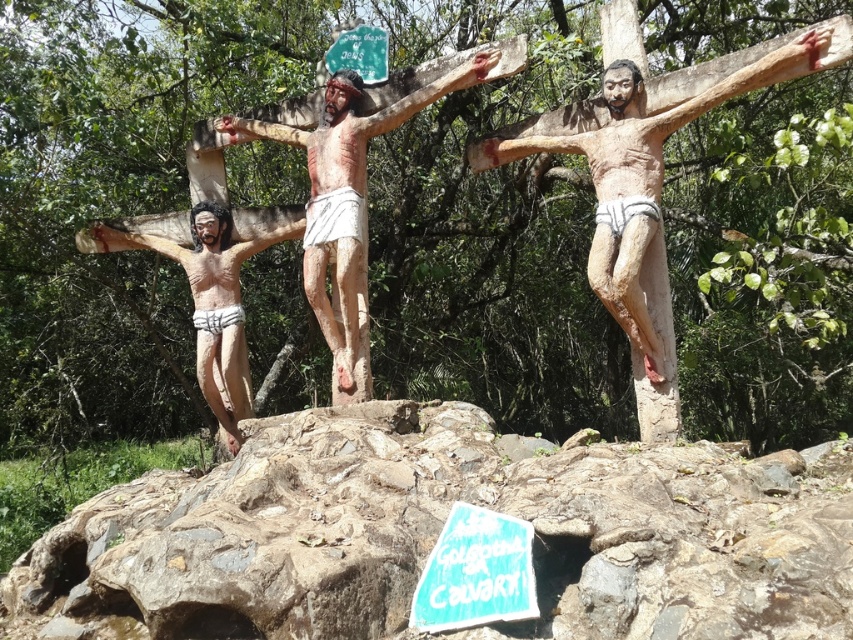
Question: Which object is the farthest from the green plastic sign at upper center?

Choices:
 (A) blue painted wood sign at lower center
 (B) matte wood crucifix at center

Answer: (A)

Question: Which object is positioned closest to the matte wooden crucifix at center?

Choices:
 (A) matte wood crucifix at left
 (B) blue painted wood sign at lower center
 (C) rough stone boulder at center
 (D) matte wood crucifix at center

Answer: (A)

Question: Which point is closer to the camera?

Choices:
 (A) matte wood crucifix at left
 (B) blue painted wood sign at lower center
 (C) rough stone boulder at center
 (D) matte wooden crucifix at center

Answer: (C)

Question: Can you confirm if rough stone boulder at center is positioned to the left of matte wood crucifix at left?

Choices:
 (A) no
 (B) yes

Answer: (A)

Question: In this image, where is rough stone boulder at center located relative to matte wood crucifix at left?

Choices:
 (A) right
 (B) left

Answer: (A)

Question: Does matte wood crucifix at left appear over blue painted wood sign at lower center?

Choices:
 (A) yes
 (B) no

Answer: (A)